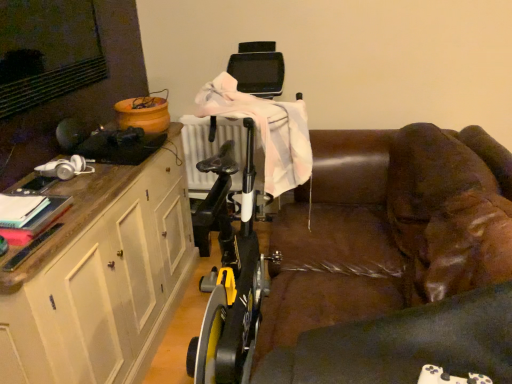
Question: Considering the positions of brown leather couch at center and white wood cabinet at left in the image, is brown leather couch at center wider or thinner than white wood cabinet at left?

Choices:
 (A) thin
 (B) wide

Answer: (B)

Question: In terms of height, does brown leather couch at center look taller or shorter compared to white wood cabinet at left?

Choices:
 (A) short
 (B) tall

Answer: (A)

Question: From the image's perspective, is brown leather couch at center located above or below white wood cabinet at left?

Choices:
 (A) above
 (B) below

Answer: (A)

Question: Choose the correct answer: Is white wood cabinet at left inside brown leather couch at center or outside it?

Choices:
 (A) inside
 (B) outside

Answer: (B)

Question: In terms of size, does white wood cabinet at left appear bigger or smaller than brown leather couch at center?

Choices:
 (A) big
 (B) small

Answer: (B)

Question: Is white wood cabinet at left wider or thinner than brown leather couch at center?

Choices:
 (A) wide
 (B) thin

Answer: (B)

Question: Is point (117, 221) closer or farther from the camera than point (465, 160)?

Choices:
 (A) farther
 (B) closer

Answer: (B)